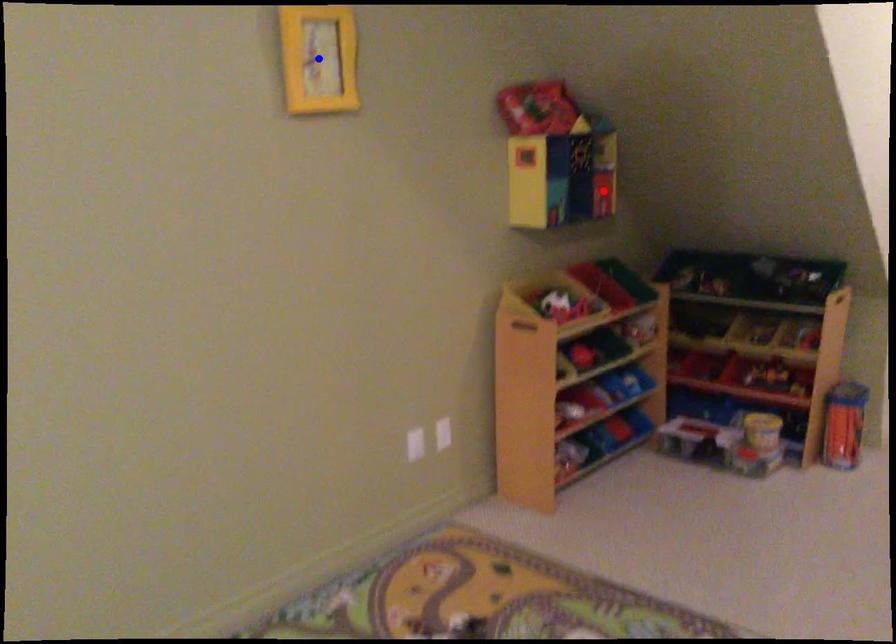
Question: Two points are marked on the image. Which point is closer to the camera?

Choices:
 (A) Blue point is closer.
 (B) Red point is closer.

Answer: (A)